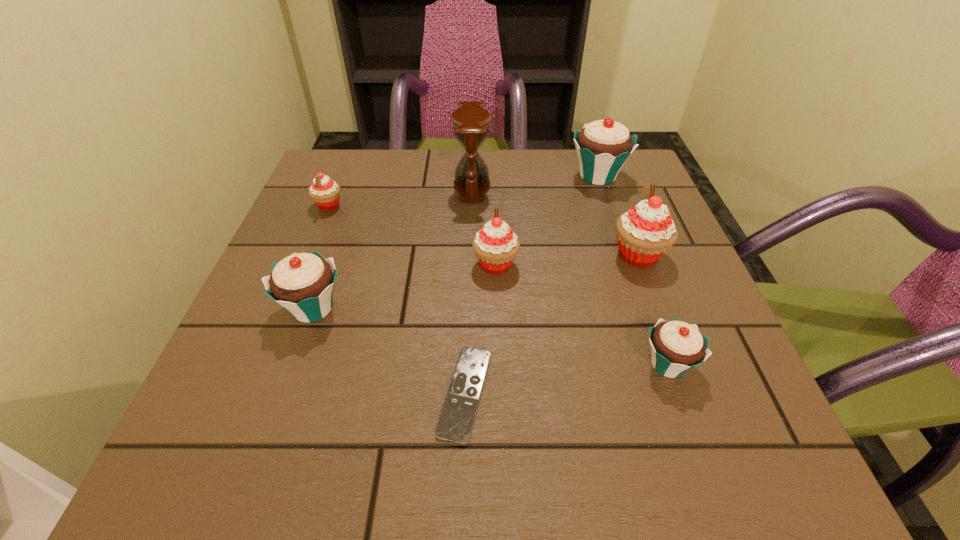
Find the location of a particular element. The width and height of the screenshot is (960, 540). free spot between the rightmost pink cupcake and the second pink cupcake from left to right is located at coordinates (566, 259).

In order to click on object that ranks as the third closest to the smallest teal cupcake in this screenshot , I will do `click(455, 424)`.

Identify which object is located as the fourth nearest to the second smallest pink cupcake. Please provide its 2D coordinates. Your answer should be formatted as a tuple, i.e. [(x, y)], where the tuple contains the x and y coordinates of a point satisfying the conditions above.

[(303, 283)]

Where is `the fourth closest cupcake to the brown hourglass`? The height and width of the screenshot is (540, 960). the fourth closest cupcake to the brown hourglass is located at coordinates (644, 233).

The image size is (960, 540). I want to click on the closest cupcake to the second biggest pink cupcake, so click(x=644, y=233).

Locate an element on the screen. teal cupcake that is the second nearest to the shortest object is located at coordinates (676, 346).

This screenshot has width=960, height=540. What are the coordinates of `the closest teal cupcake to the second smallest pink cupcake` in the screenshot? It's located at (303, 283).

Identify the location of the closest pink cupcake to the farthest pink cupcake. (495, 245).

Find the location of `pink cupcake object that ranks as the third closest to the smallest teal cupcake`. pink cupcake object that ranks as the third closest to the smallest teal cupcake is located at coordinates (325, 192).

Image resolution: width=960 pixels, height=540 pixels. Find the location of `free space in the image that satisfies the following two spatial constraints: 1. on the front side of the nearest teal cupcake; 2. on the left side of the hourglass`. free space in the image that satisfies the following two spatial constraints: 1. on the front side of the nearest teal cupcake; 2. on the left side of the hourglass is located at coordinates (468, 364).